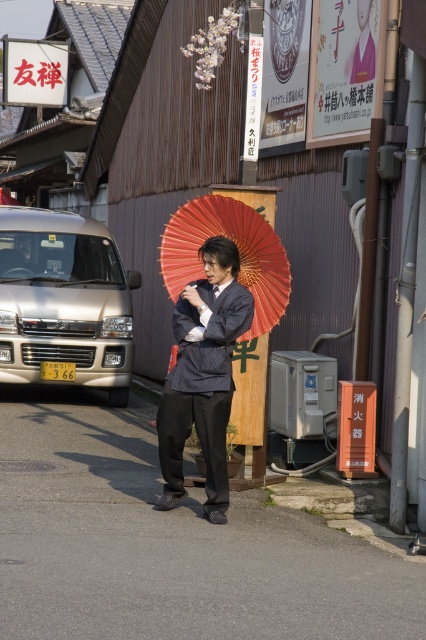
Based on the photo, you are a photographer trying to capture the striped fabric suit at center and the red paper umbrella at center in a single frame. Which object should you adjust your camera angle to focus on first to ensure both are in the shot?

The striped fabric suit at center is positioned on the left side of the red paper umbrella at center, so you should focus on the red paper umbrella at center first to ensure both are included in the frame.

You are a delivery driver who needs to park your van in the street scene shown. The parking spot is marked by the point at coordinates (63, 301). Can you safely park your van there without blocking the sidewalk?

The point at coordinates (63, 301) indicates a metallic gold van at left, meaning the parking spot is already occupied by a van. Therefore, you cannot park there without blocking the sidewalk.